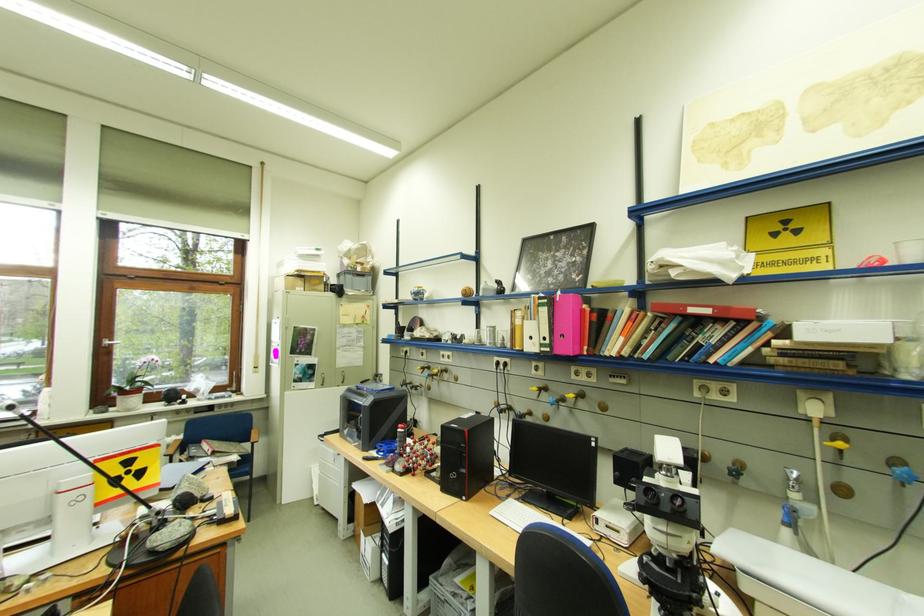
Where would you pull the metal cabinet handle? Please return your answer as a coordinate pair (x, y).

(110, 342)